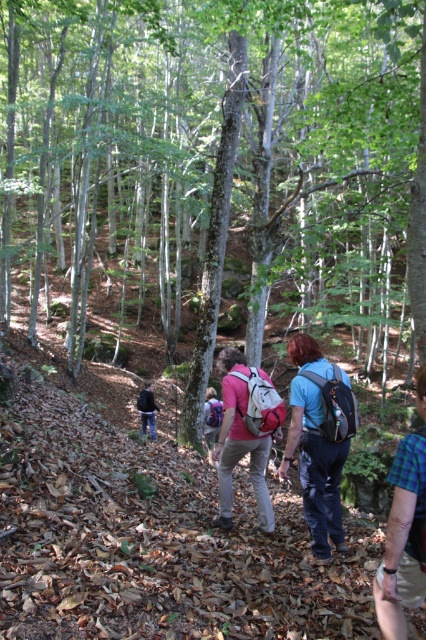
You are a hiker trying to locate your gear. You see a matte pink backpack at center and a flannel shirt at lower right. Which item is closer to you?

The matte pink backpack at center is closer to you because it is further to the viewer than the flannel shirt at lower right.

You are a hiker trying to locate your friend wearing a flannel shirt at lower right. You see a rough bark tree at center in your view. Which direction should you move to find your friend?

You should move to the left of the rough bark tree at center to find the flannel shirt at lower right, since the rough bark tree at center is positioned on the right side of flannel shirt at lower right.

You are a hiker who wants to know if your matte blue backpack at center will fit into a storage compartment that is the same height as the flannel shirt at lower right. Can it fit?

The matte blue backpack at center is taller than the flannel shirt at lower right, so it will not fit into the storage compartment that matches the shirt height.